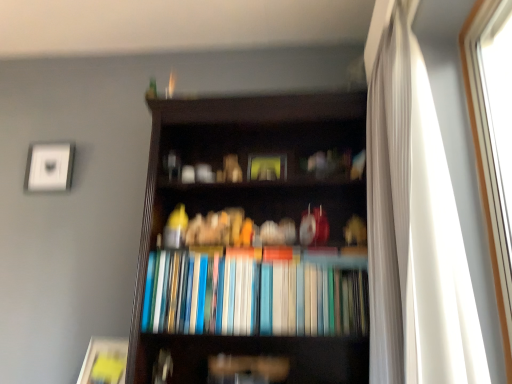
Question: Is matte yellow paperback book at lower left thinner than white glass window at right?

Choices:
 (A) no
 (B) yes

Answer: (A)

Question: Is matte yellow paperback book at lower left positioned before white glass window at right?

Choices:
 (A) yes
 (B) no

Answer: (B)

Question: Can you confirm if matte yellow paperback book at lower left is taller than white glass window at right?

Choices:
 (A) yes
 (B) no

Answer: (B)

Question: From a real-world perspective, is matte yellow paperback book at lower left physically above white glass window at right?

Choices:
 (A) no
 (B) yes

Answer: (A)

Question: Is white glass window at right surrounded by matte yellow paperback book at lower left?

Choices:
 (A) yes
 (B) no

Answer: (B)

Question: Based on their sizes in the image, would you say matte yellow paperback book at lower left is bigger or smaller than white glass window at right?

Choices:
 (A) small
 (B) big

Answer: (A)

Question: From the image's perspective, is matte yellow paperback book at lower left above or below white glass window at right?

Choices:
 (A) above
 (B) below

Answer: (B)

Question: Considering their positions, is matte yellow paperback book at lower left located in front of or behind white glass window at right?

Choices:
 (A) front
 (B) behind

Answer: (B)

Question: From a real-world perspective, is matte yellow paperback book at lower left positioned above or below white glass window at right?

Choices:
 (A) above
 (B) below

Answer: (B)

Question: Considering their positions, is white glass window at right located in front of or behind matte white picture frame at upper left?

Choices:
 (A) behind
 (B) front

Answer: (B)

Question: Visually, is white glass window at right positioned to the left or to the right of matte white picture frame at upper left?

Choices:
 (A) right
 (B) left

Answer: (A)

Question: In terms of width, does white glass window at right look wider or thinner when compared to matte white picture frame at upper left?

Choices:
 (A) thin
 (B) wide

Answer: (B)

Question: From a real-world perspective, is white glass window at right above or below matte white picture frame at upper left?

Choices:
 (A) above
 (B) below

Answer: (B)

Question: In terms of width, does white sheer curtain at right look wider or thinner when compared to hardcover books at center?

Choices:
 (A) thin
 (B) wide

Answer: (B)

Question: Is point (384, 120) positioned closer to the camera than point (150, 259)?

Choices:
 (A) farther
 (B) closer

Answer: (B)